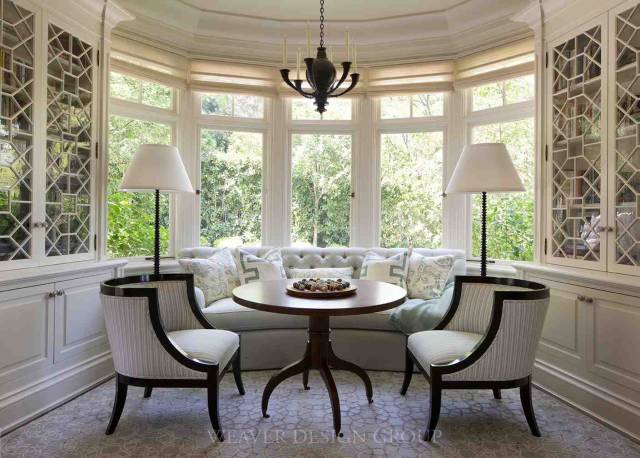
This screenshot has width=640, height=458. What are the coordinates of `chair l` in the screenshot? It's located at (146, 360).